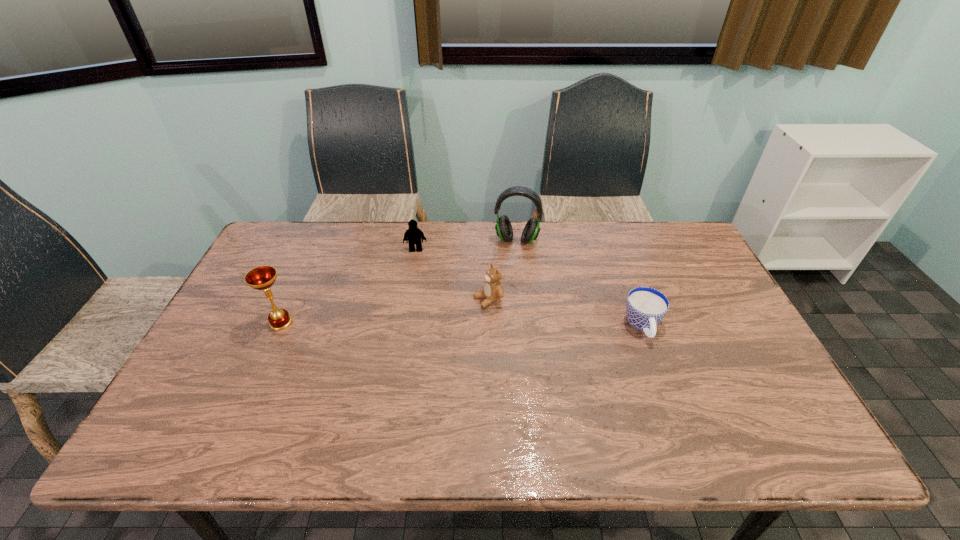
Find the location of a particular element. This screenshot has height=540, width=960. vacant area between the chalice and the Lego is located at coordinates (348, 286).

Find the location of `free space between the headset and the chalice`. free space between the headset and the chalice is located at coordinates (398, 281).

Where is `vacant space that is in between the Lego and the leftmost object`? The height and width of the screenshot is (540, 960). vacant space that is in between the Lego and the leftmost object is located at coordinates (348, 286).

The image size is (960, 540). I want to click on free space between the chalice and the shortest object, so click(x=462, y=325).

Where is `free space between the chalice and the teddy bear`? This screenshot has width=960, height=540. free space between the chalice and the teddy bear is located at coordinates pyautogui.click(x=385, y=310).

Identify the location of object that ranks as the second closest to the Lego. (493, 290).

Where is `the fourth closest object to the rightmost object`? the fourth closest object to the rightmost object is located at coordinates (263, 277).

Identify the location of vacant point that satisfies the following two spatial constraints: 1. on the front side of the teddy bear; 2. on the right side of the fourth object from right to left. (407, 298).

This screenshot has height=540, width=960. Find the location of `free location that satisfies the following two spatial constraints: 1. on the back side of the leftmost object; 2. on the right side of the fourth object from right to left`. free location that satisfies the following two spatial constraints: 1. on the back side of the leftmost object; 2. on the right side of the fourth object from right to left is located at coordinates (314, 249).

Find the location of a particular element. vacant area that satisfies the following two spatial constraints: 1. on the back side of the leftmost object; 2. on the right side of the teddy bear is located at coordinates (292, 298).